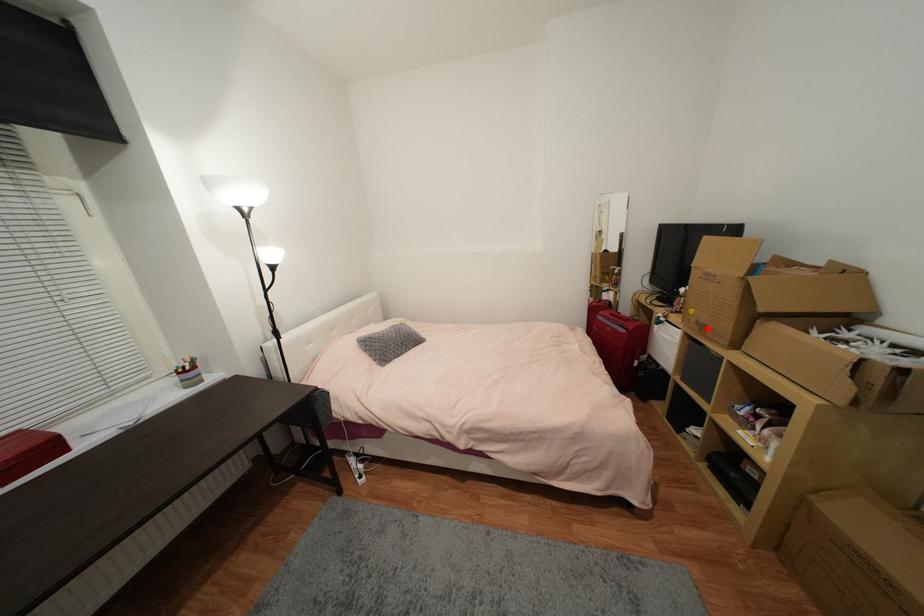
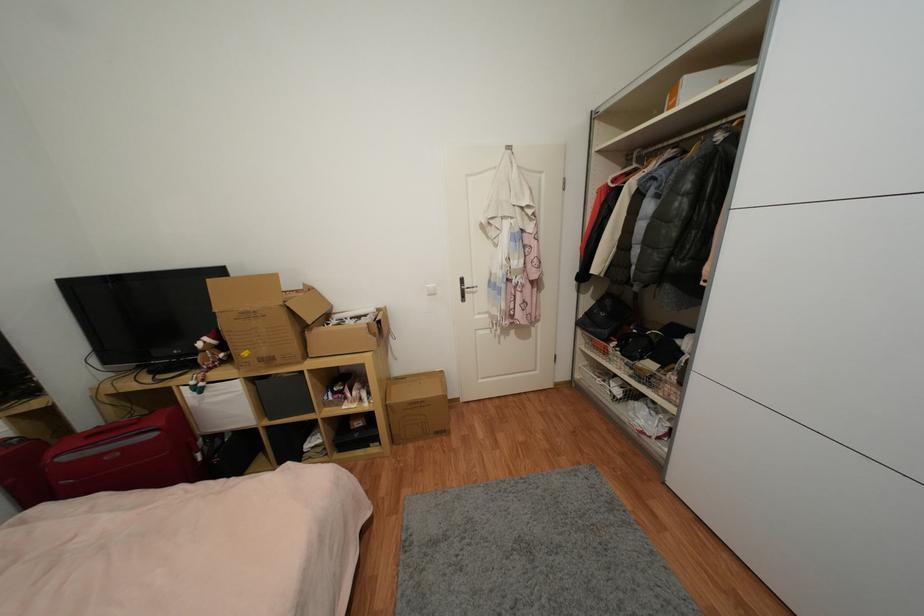
Question: I am providing you with two images of the same scene from different viewpoints. A red point is marked on the first image. Can you still see the location of the red point in image 2?

Choices:
 (A) Yes
 (B) No

Answer: (A)